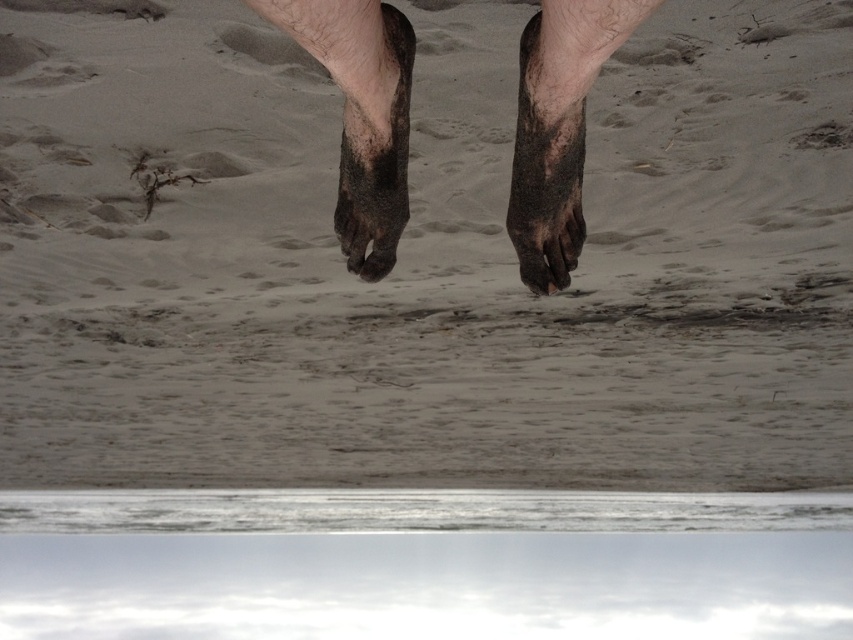
You are standing at the shoreline and see two footprints, one from dull black feet at center and another from dirty sand foot at center. Which footprint is more to the left?

The dull black feet at center is positioned on the left side of dirty sand foot at center, so the dull black feet at center is more to the left.

You are a lifeguard on duty and notice two objects at the water edge. You need to determine which one is wider. The objects are the dull brown skin at center and the dirty sand foot at center. Which one has a greater width?

The dull brown skin at center has a greater width than the dirty sand foot at center according to the description provided.